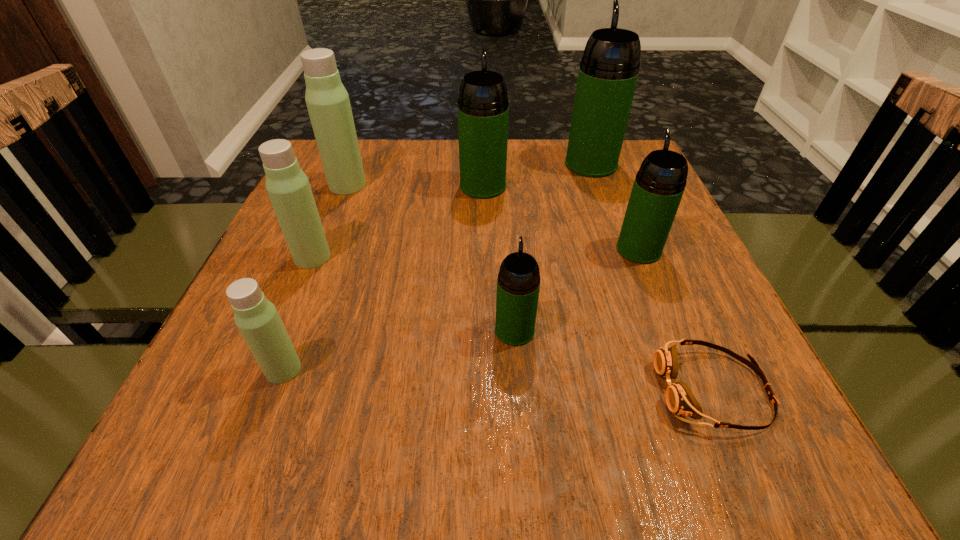
Locate an element on the screen. The image size is (960, 540). blank space located 0.290m on the right of the second biggest light thermos bottle is located at coordinates (476, 257).

Locate an element on the screen. This screenshot has height=540, width=960. vacant space located from the spout of the second nearest thermos bottle is located at coordinates (507, 219).

Find the location of `free space located 0.120m from the spout of the second nearest thermos bottle`. free space located 0.120m from the spout of the second nearest thermos bottle is located at coordinates (510, 268).

Locate an element on the screen. The width and height of the screenshot is (960, 540). vacant point located 0.190m from the spout of the second nearest thermos bottle is located at coordinates (509, 245).

Where is `blank space located on the back of the smallest light thermos bottle`? Image resolution: width=960 pixels, height=540 pixels. blank space located on the back of the smallest light thermos bottle is located at coordinates (342, 214).

At what (x,y) coordinates should I click in order to perform the action: click on free space located 0.130m with the lenses facing forward on the goggles. Please return your answer as a coordinate pair (x, y). The height and width of the screenshot is (540, 960). Looking at the image, I should click on (572, 389).

The width and height of the screenshot is (960, 540). I want to click on free spot located with the lenses facing forward on the goggles, so click(x=499, y=389).

This screenshot has height=540, width=960. Find the location of `free space located with the lenses facing forward on the goggles`. free space located with the lenses facing forward on the goggles is located at coordinates (412, 389).

The width and height of the screenshot is (960, 540). What are the coordinates of `object at the near edge` in the screenshot? It's located at (680, 400).

This screenshot has height=540, width=960. In order to click on goggles at the right edge in this screenshot , I will do `click(680, 400)`.